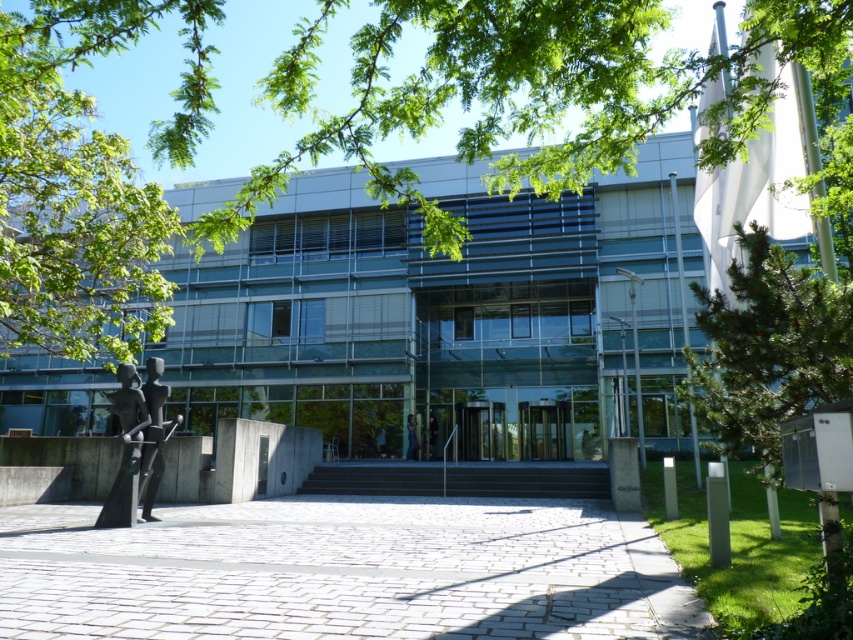
Question: Which of the following is the closest to the observer?

Choices:
 (A) green pine tree at right
 (B) transparent glass door at center

Answer: (A)

Question: Based on their relative distances, which object is nearer to the bronze statue at center?

Choices:
 (A) polished bronze statue at lower left
 (B) transparent glass door at center
 (C) green pine tree at right
 (D) green leafy tree at left

Answer: (A)

Question: Does bronze statue at center have a lesser width compared to transparent glass door at center?

Choices:
 (A) no
 (B) yes

Answer: (B)

Question: Where is polished bronze statue at lower left located in relation to transparent glass door at center in the image?

Choices:
 (A) left
 (B) right

Answer: (A)

Question: Can you confirm if bronze statue at center is thinner than polished bronze statue at lower left?

Choices:
 (A) no
 (B) yes

Answer: (A)

Question: Which point is farther to the camera?

Choices:
 (A) green pine tree at right
 (B) green leafy tree at left
 (C) bronze statue at center
 (D) polished bronze statue at lower left

Answer: (D)